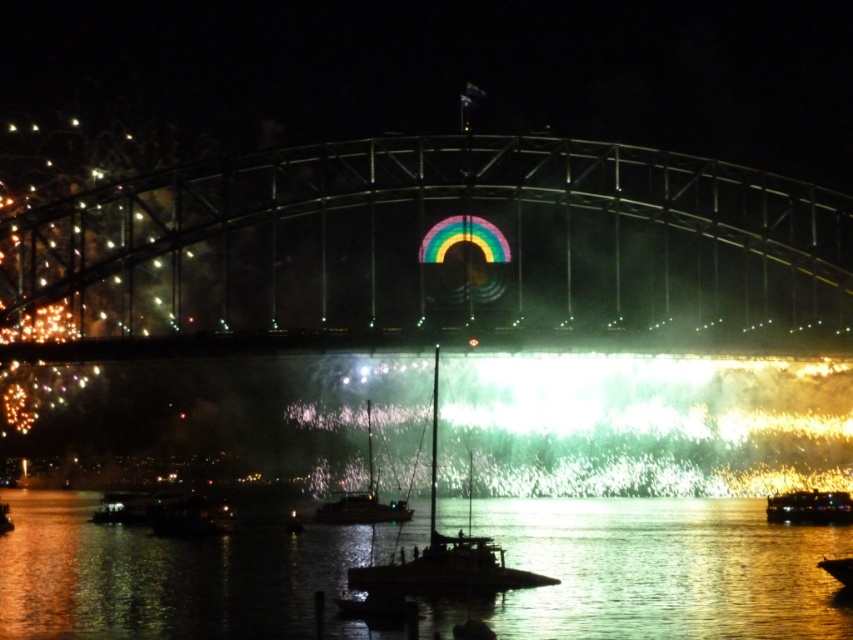
Question: From the image, what is the correct spatial relationship of metallic bridge at center in relation to metallic gold boat at lower right?

Choices:
 (A) left
 (B) right

Answer: (A)

Question: Which point appears closest to the camera in this image?

Choices:
 (A) (776, 508)
 (B) (366, 522)
 (C) (819, 621)

Answer: (C)

Question: Which object appears closest to the camera in this image?

Choices:
 (A) metallic gold boat at lower right
 (B) metallic silver boat at lower right

Answer: (A)

Question: Is metallic sailboat at center further to camera compared to shiny metallic sailboat at center?

Choices:
 (A) no
 (B) yes

Answer: (A)

Question: Which object appears farthest from the camera in this image?

Choices:
 (A) metallic sailboat at center
 (B) shiny metallic sailboat at center
 (C) glistening water at center

Answer: (B)

Question: In this image, where is metallic bridge at center located relative to metallic gold boat at lower right?

Choices:
 (A) above
 (B) below

Answer: (A)